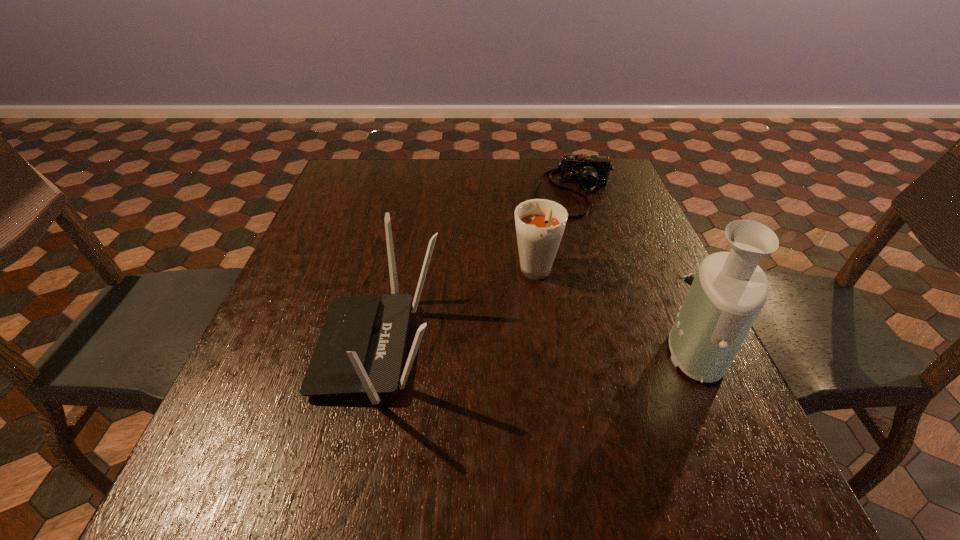
You are a GUI agent. You are given a task and a screenshot of the screen. Output one action in this format:
    pyautogui.click(x=<x>, y=<y>)
    Task: Click on the vacant space on the desktop that is between the router and the juicer and is positioned on the front-facing side of the camera
    
    Given the screenshot: What is the action you would take?
    pyautogui.click(x=572, y=350)

The width and height of the screenshot is (960, 540). What are the coordinates of `vacant spot on the desktop that is between the router and the tallest object and is positioned on the drink side of the root beer` in the screenshot? It's located at (517, 350).